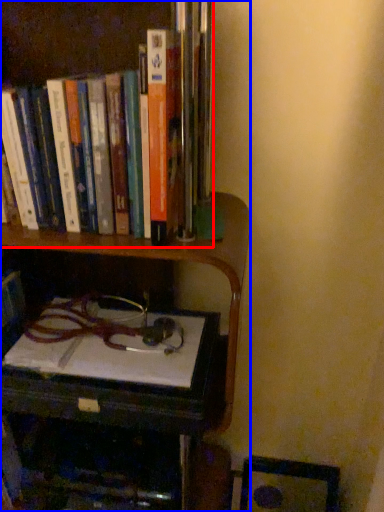
Question: Which object is closer to the camera taking this photo, book (highlighted by a red box) or bookcase (highlighted by a blue box)?

Choices:
 (A) book
 (B) bookcase

Answer: (B)